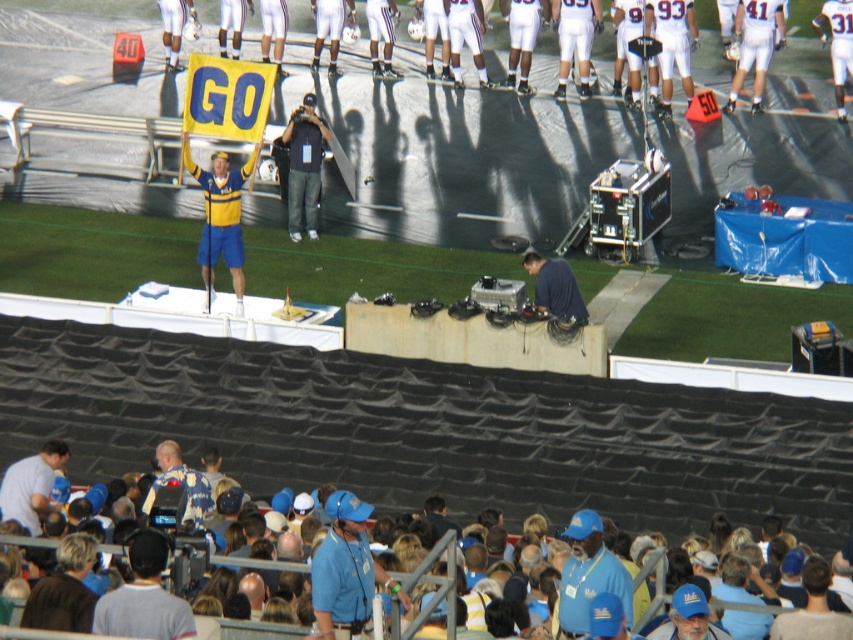
Does gray cotton shirt at lower left have a greater width compared to blue fabric cap at lower center?

Yes, gray cotton shirt at lower left is wider than blue fabric cap at lower center.

Measure the distance between point (144, 556) and camera.

Point (144, 556) is 16.71 meters from camera.

Between point (160, 604) and point (628, 573), which one is positioned behind?

The point (628, 573) is more distant.

The image size is (853, 640). In order to click on gray cotton shirt at lower left in this screenshot , I will do `click(144, 596)`.

Which is in front, point (65, 624) or point (30, 518)?

Positioned in front is point (65, 624).

Is point (38, 598) positioned after point (10, 467)?

No, (38, 598) is closer to viewer.

Where is `brown leather jacket at lower left`? The image size is (853, 640). brown leather jacket at lower left is located at coordinates (64, 589).

What do you see at coordinates (144, 596) in the screenshot? I see `gray cotton shirt at lower left` at bounding box center [144, 596].

Is gray cotton shirt at lower left to the right of blue denim jacket at lower center from the viewer's perspective?

Correct, you'll find gray cotton shirt at lower left to the right of blue denim jacket at lower center.

Is point (144, 568) positioned after point (177, 456)?

No, it is in front of (177, 456).

Where is `gray cotton shirt at lower left`? gray cotton shirt at lower left is located at coordinates (144, 596).